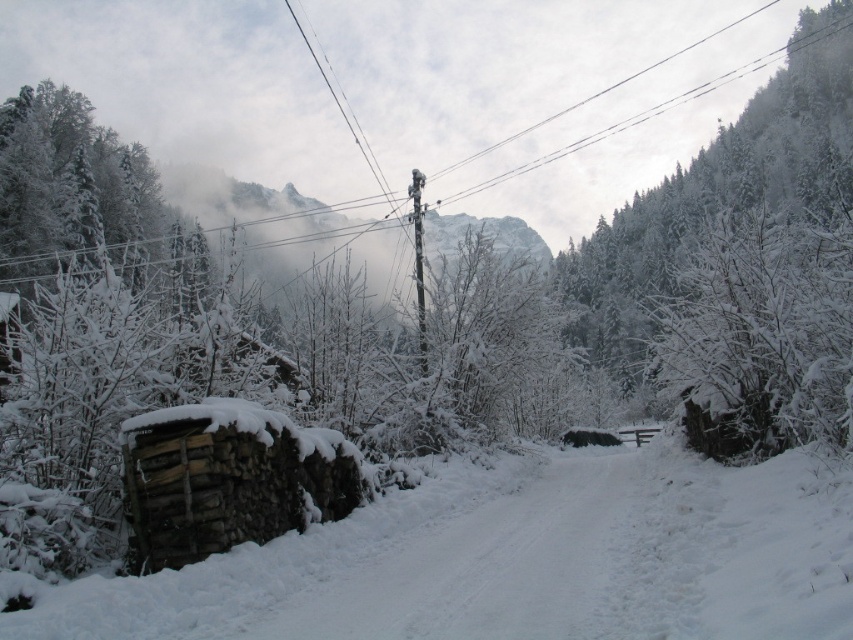
You are standing at the point with coordinates point (47,262) and want to walk towards the point with coordinates point (793,129). Which direction should you face to move towards it?

Since point (793,129) is behind point (47,262), you should face backwards to move towards it.

You are an explorer trying to navigate through the snow. You see a white frosty tree at right and white frosty trees at left. Which group of trees has a wider spread?

The white frosty trees at left have a wider spread than the white frosty tree at right.